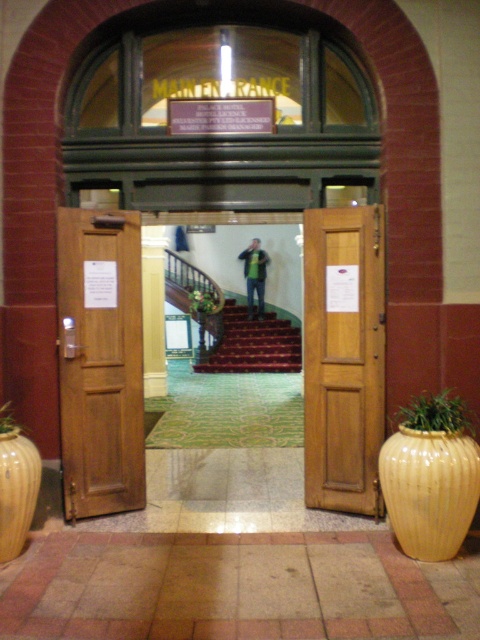
Can you confirm if wooden door at right is positioned below matte yellow vase at right?

No.

Does wooden door at right have a greater height compared to matte yellow vase at right?

Yes, wooden door at right is taller than matte yellow vase at right.

Locate an element on the screen. The width and height of the screenshot is (480, 640). wooden door at right is located at coordinates (344, 356).

Is point (257, 346) closer to camera compared to point (0, 529)?

No, (257, 346) is behind (0, 529).

Does maroon carpeted stairs at center have a larger size compared to matte yellow vase at left?

Yes, maroon carpeted stairs at center is bigger than matte yellow vase at left.

Describe the element at coordinates (252, 342) in the screenshot. I see `maroon carpeted stairs at center` at that location.

This screenshot has width=480, height=640. Find the location of `maroon carpeted stairs at center`. maroon carpeted stairs at center is located at coordinates [x=252, y=342].

How much distance is there between wooden door at left and green textured plant at lower right?

A distance of 7.00 feet exists between wooden door at left and green textured plant at lower right.

Which is in front, point (96, 381) or point (446, 406)?

Point (446, 406)

Image resolution: width=480 pixels, height=640 pixels. Identify the location of wooden door at left. (100, 362).

Identify the location of wooden door at left. The image size is (480, 640). (100, 362).